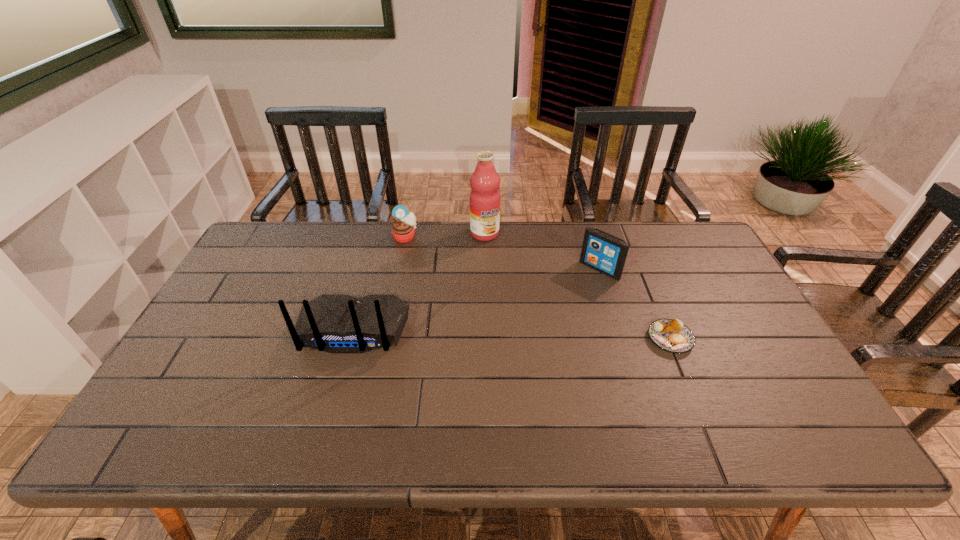
Locate an element on the screen. The height and width of the screenshot is (540, 960). free location located on the front-facing side of the muffin is located at coordinates (417, 251).

This screenshot has height=540, width=960. I want to click on vacant space situated on the front-facing side of the muffin, so click(423, 261).

The image size is (960, 540). In order to click on free space located 0.240m on the front-facing side of the muffin in this screenshot , I will do `click(442, 285)`.

I want to click on free spot located 0.250m on the label of the tallest object, so click(x=516, y=289).

This screenshot has height=540, width=960. Identify the location of vacant position located 0.380m on the label of the tallest object. (534, 320).

In order to click on free point located on the label of the tallest object in this screenshot , I will do `click(519, 294)`.

Identify the location of vacant area situated on the front screen of the iPod. The image size is (960, 540). (514, 353).

I want to click on free space located on the front screen of the iPod, so click(531, 335).

You are a GUI agent. You are given a task and a screenshot of the screen. Output one action in this format:
    pyautogui.click(x=<x>, y=<y>)
    Task: Click on the blank space located on the front screen of the iPod
    Image resolution: width=960 pixels, height=540 pixels.
    Given the screenshot: What is the action you would take?
    pyautogui.click(x=580, y=288)

Locate an element on the screen. The height and width of the screenshot is (540, 960). muffin that is at the far edge is located at coordinates (403, 229).